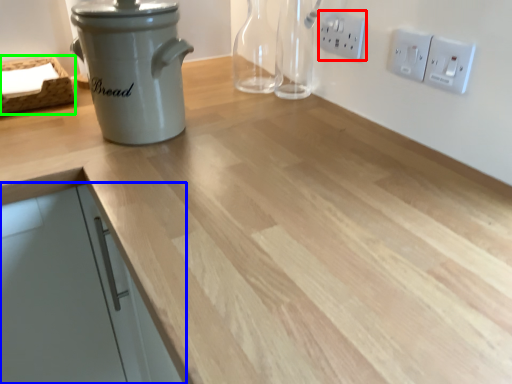
Question: Considering the real-world distances, which object is farthest from electric outlet (highlighted by a red box)? cabinetry (highlighted by a blue box) or basket (highlighted by a green box)?

Choices:
 (A) cabinetry
 (B) basket

Answer: (A)